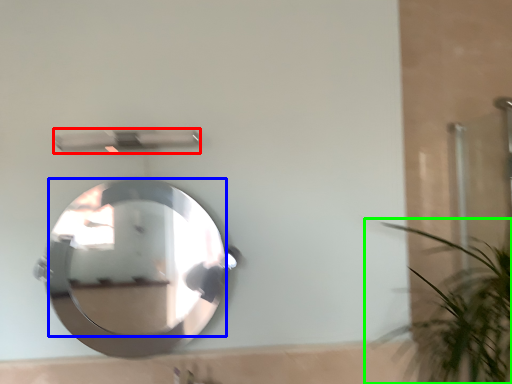
Question: Which object is positioned closest to shower (highlighted by a red box)? Select from mirror (highlighted by a blue box) and houseplant (highlighted by a green box).

Choices:
 (A) mirror
 (B) houseplant

Answer: (B)